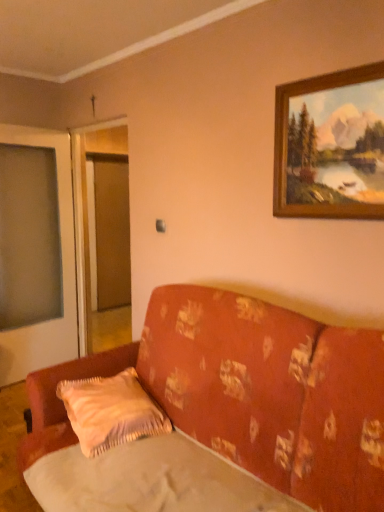
Question: In terms of height, does wooden frame at upper right look taller or shorter compared to fluffy beige pillow at lower center?

Choices:
 (A) short
 (B) tall

Answer: (B)

Question: Is wooden frame at upper right bigger or smaller than fluffy beige pillow at lower center?

Choices:
 (A) big
 (B) small

Answer: (B)

Question: Estimate the real-world distances between objects in this image. Which object is farther from the transparent glass screen door at left?

Choices:
 (A) fluffy beige pillow at lower center
 (B) wooden frame at upper right
 (C) floral fabric couch at center
 (D) silky beige sheet at lower center
 (E) transparent plastic window screen at left

Answer: (D)

Question: Estimate the real-world distances between objects in this image. Which object is farther from the fluffy beige pillow at lower center?

Choices:
 (A) transparent glass screen door at left
 (B) silky beige sheet at lower center
 (C) transparent plastic window screen at left
 (D) floral fabric couch at center
 (E) wooden frame at upper right

Answer: (A)